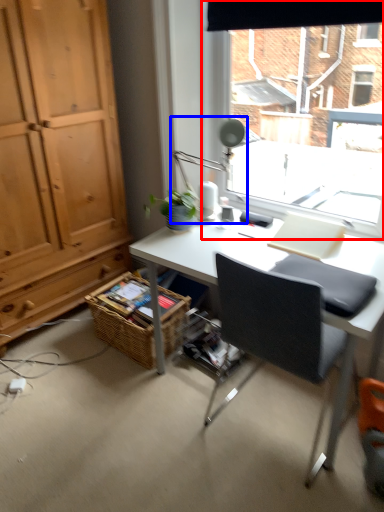
Question: Among these objects, which one is farthest to the camera, window (highlighted by a red box) or table lamp (highlighted by a blue box)?

Choices:
 (A) window
 (B) table lamp

Answer: (B)